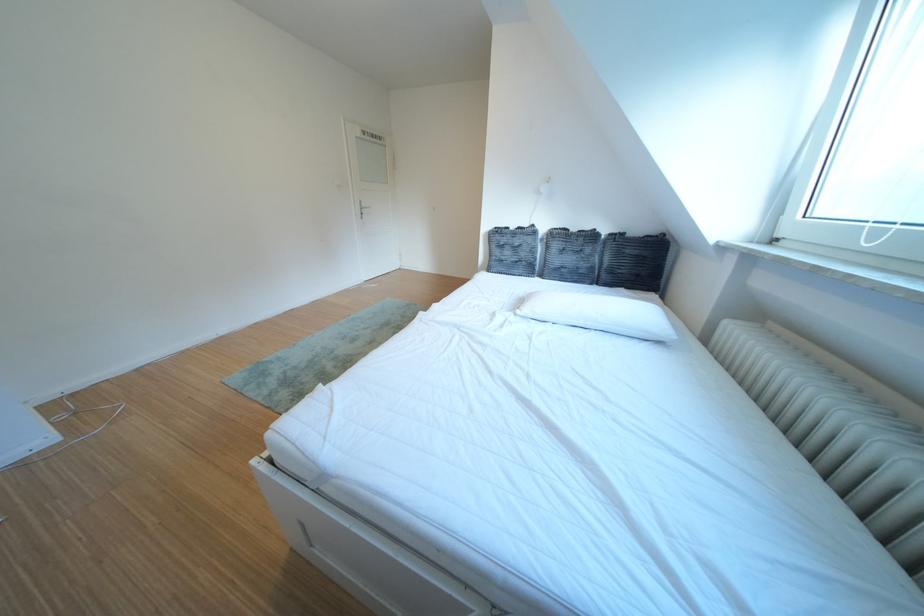
The height and width of the screenshot is (616, 924). Describe the element at coordinates (869, 229) in the screenshot. I see `the window blind chain` at that location.